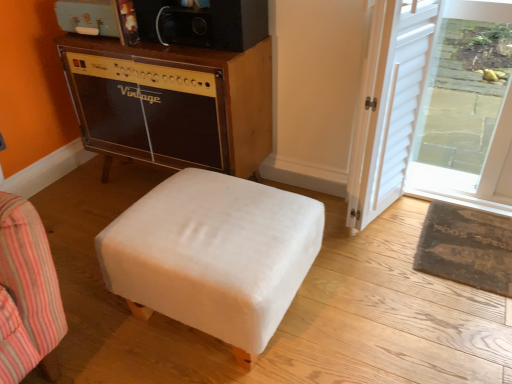
Question: From the image's perspective, does rustic brown mat at lower right appear lower than transparent glass door at upper right?

Choices:
 (A) no
 (B) yes

Answer: (B)

Question: Is rustic brown mat at lower right positioned in front of transparent glass door at upper right?

Choices:
 (A) yes
 (B) no

Answer: (B)

Question: Can you confirm if rustic brown mat at lower right is positioned to the left of transparent glass door at upper right?

Choices:
 (A) yes
 (B) no

Answer: (A)

Question: Is rustic brown mat at lower right aimed at transparent glass door at upper right?

Choices:
 (A) yes
 (B) no

Answer: (B)

Question: Can you confirm if rustic brown mat at lower right is shorter than transparent glass door at upper right?

Choices:
 (A) no
 (B) yes

Answer: (B)

Question: Looking at their shapes, would you say rustic brown mat at lower right is wider or thinner than white velvety ottoman at center?

Choices:
 (A) wide
 (B) thin

Answer: (B)

Question: Visually, is rustic brown mat at lower right positioned to the left or to the right of white velvety ottoman at center?

Choices:
 (A) left
 (B) right

Answer: (B)

Question: Based on their sizes in the image, would you say rustic brown mat at lower right is bigger or smaller than white velvety ottoman at center?

Choices:
 (A) big
 (B) small

Answer: (B)

Question: Is rustic brown mat at lower right in front of or behind white velvety ottoman at center in the image?

Choices:
 (A) behind
 (B) front

Answer: (A)

Question: From the image's perspective, is rustic brown mat at lower right located above or below transparent glass door at upper right?

Choices:
 (A) above
 (B) below

Answer: (B)

Question: Is rustic brown mat at lower right situated inside transparent glass door at upper right or outside?

Choices:
 (A) outside
 (B) inside

Answer: (A)

Question: From their relative heights in the image, would you say rustic brown mat at lower right is taller or shorter than transparent glass door at upper right?

Choices:
 (A) short
 (B) tall

Answer: (A)

Question: Is rustic brown mat at lower right in front of or behind transparent glass door at upper right in the image?

Choices:
 (A) behind
 (B) front

Answer: (A)

Question: Would you say transparent glass door at upper right is inside or outside vintage wood amplifier at upper left?

Choices:
 (A) outside
 (B) inside

Answer: (A)

Question: In the image, is transparent glass door at upper right on the left side or the right side of vintage wood amplifier at upper left?

Choices:
 (A) left
 (B) right

Answer: (B)